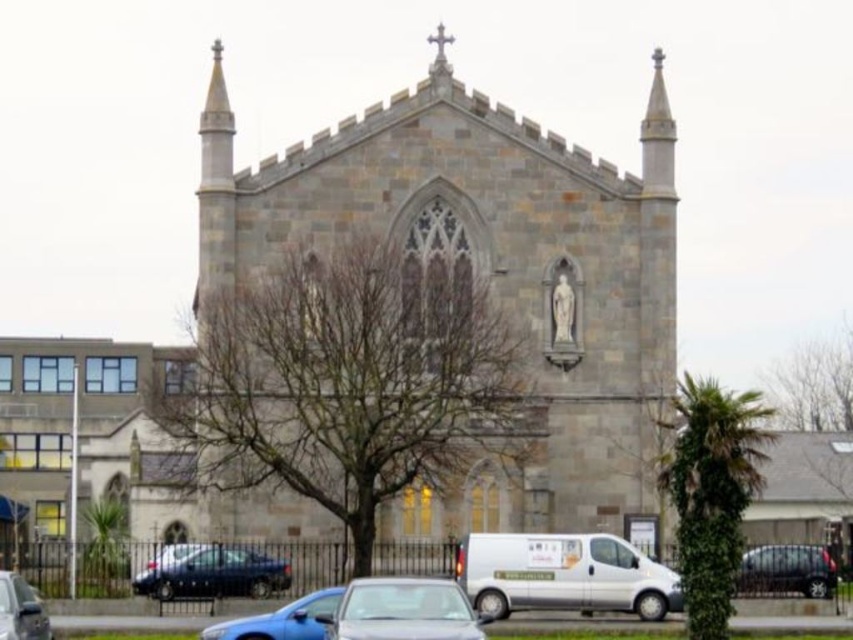
Does gray stone chapel at center have a greater height compared to blue metallic car at center?

Yes.

Between gray stone chapel at center and blue metallic car at center, which one appears on the right side from the viewer's perspective?

Positioned to the right is gray stone chapel at center.

Where is `gray stone chapel at center`? gray stone chapel at center is located at coordinates (425, 321).

Measure the distance between gray stone chapel at center and white metallic van at lower center.

gray stone chapel at center and white metallic van at lower center are 12.96 meters apart.

Is point (560, 371) farther from viewer compared to point (548, 576)?

Yes, point (560, 371) is farther from viewer.

Which is in front, point (467, 304) or point (596, 580)?

Point (596, 580) is more forward.

You are a GUI agent. You are given a task and a screenshot of the screen. Output one action in this format:
    pyautogui.click(x=<x>, y=<y>)
    Task: Click on the gray stone chapel at center
    The image size is (853, 640).
    Given the screenshot: What is the action you would take?
    pyautogui.click(x=425, y=321)

Is white metallic van at lower center thinner than metallic silver car at lower left?

In fact, white metallic van at lower center might be wider than metallic silver car at lower left.

Is point (547, 596) positioned before point (0, 634)?

No.

You are a GUI agent. You are given a task and a screenshot of the screen. Output one action in this format:
    pyautogui.click(x=<x>, y=<y>)
    Task: Click on the white metallic van at lower center
    
    Given the screenshot: What is the action you would take?
    pyautogui.click(x=563, y=573)

The width and height of the screenshot is (853, 640). I want to click on white metallic van at lower center, so click(x=563, y=573).